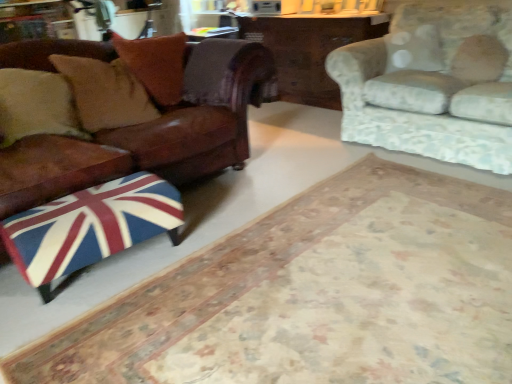
Question: From a real-world perspective, is union jack fabric ottoman at lower left positioned above or below fluffy white pillow at upper right, the 1th pillow when ordered from right to left?

Choices:
 (A) above
 (B) below

Answer: (B)

Question: Is point (64, 200) positioned closer to the camera than point (465, 44)?

Choices:
 (A) farther
 (B) closer

Answer: (B)

Question: Based on their relative distances, which object is farther from the leather couch at left, the second studio couch positioned from the right?

Choices:
 (A) floral fabric couch at upper right, which is counted as the 2th studio couch, starting from the left
 (B) wooden table at center
 (C) fluffy white pillow at upper right, the 1th pillow when ordered from right to left
 (D) union jack fabric ottoman at lower left
 (E) brown leather pillow at upper left, marked as the second pillow in a left-to-right arrangement

Answer: (C)

Question: Estimate the real-world distances between objects in this image. Which object is farther from the union jack fabric ottoman at lower left?

Choices:
 (A) leather cushion at left, the 1th pillow from the left
 (B) leather couch at left, the first studio couch when ordered from left to right
 (C) floral fabric couch at upper right, the first studio couch when ordered from right to left
 (D) brown leather pillow at upper left, marked as the second pillow in a left-to-right arrangement
 (E) wooden table at center

Answer: (E)